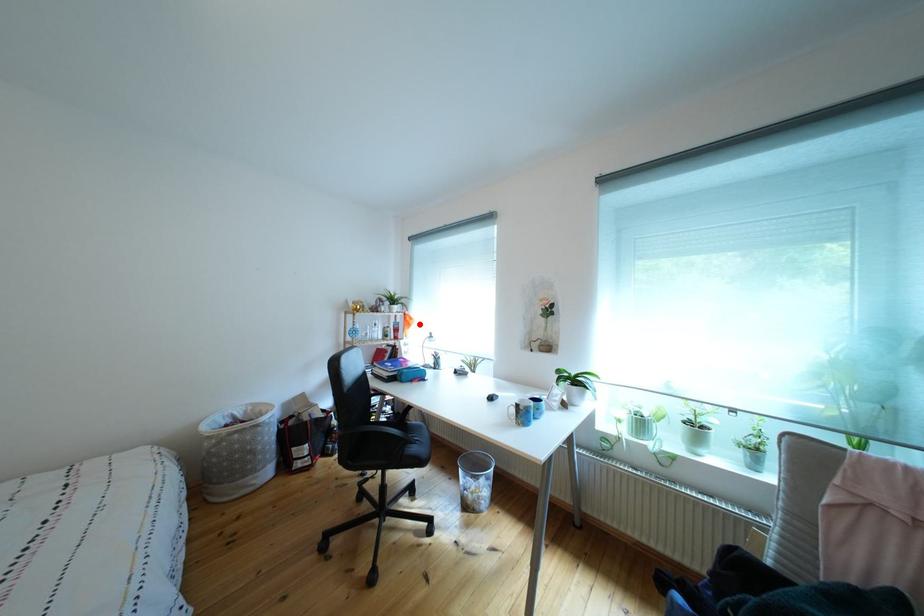
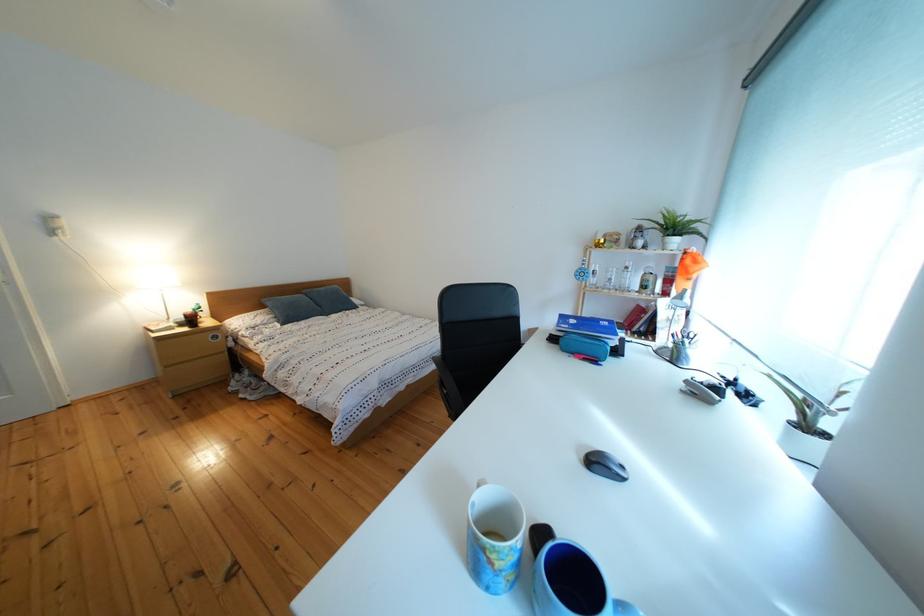
Question: I am providing you with two images of the same scene from different viewpoints. In image1, a red point is highlighted. Considering the same 3D point in image2, which of the following is correct?

Choices:
 (A) It is closer
 (B) It is farther

Answer: (A)